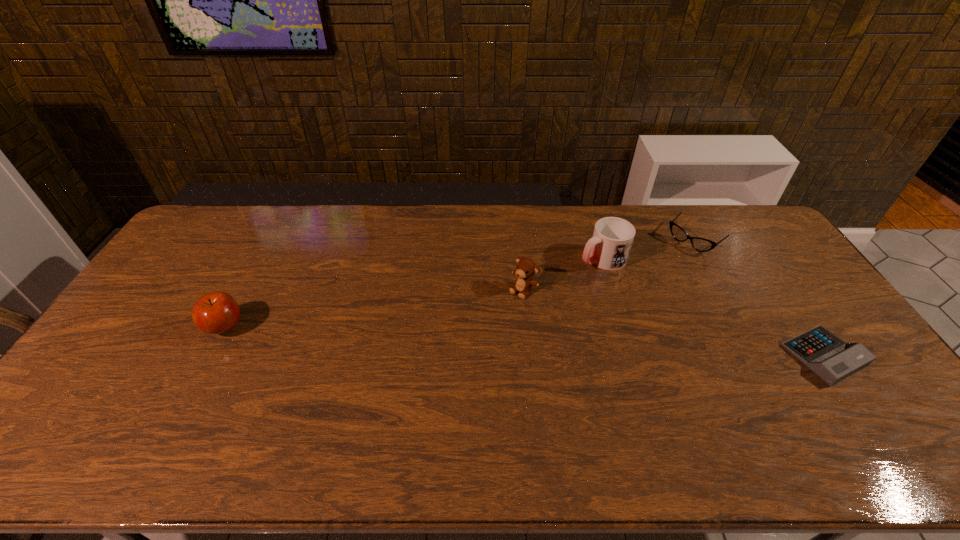
Where is `vacant space situated 0.120m on the side of the mug with the handle`? vacant space situated 0.120m on the side of the mug with the handle is located at coordinates (555, 279).

At what (x,y) coordinates should I click in order to perform the action: click on free location located 0.180m on the front-facing side of the spectacles. Please return your answer as a coordinate pair (x, y). The height and width of the screenshot is (540, 960). Looking at the image, I should click on (653, 276).

Identify the location of free region located on the front-facing side of the spectacles. Image resolution: width=960 pixels, height=540 pixels. (660, 271).

The height and width of the screenshot is (540, 960). In order to click on free space located 0.160m on the front-facing side of the spectacles in this screenshot , I will do `click(656, 274)`.

What are the coordinates of `vacant space located on the face of the second object from left to right` in the screenshot? It's located at (426, 381).

Where is `vacant area situated 0.060m on the face of the second object from left to right`? This screenshot has height=540, width=960. vacant area situated 0.060m on the face of the second object from left to right is located at coordinates (503, 309).

You are a GUI agent. You are given a task and a screenshot of the screen. Output one action in this format:
    pyautogui.click(x=<x>, y=<y>)
    Task: Click on the free location located 0.240m on the face of the second object from left to right
    This screenshot has height=540, width=960.
    Given the screenshot: What is the action you would take?
    pyautogui.click(x=464, y=345)

Locate an element on the screen. object situated at the far edge is located at coordinates (700, 244).

What are the coordinates of `object situated at the right edge` in the screenshot? It's located at [x=831, y=359].

In the image, there is a desktop. Identify the location of vacant space at the far edge. Image resolution: width=960 pixels, height=540 pixels. (359, 242).